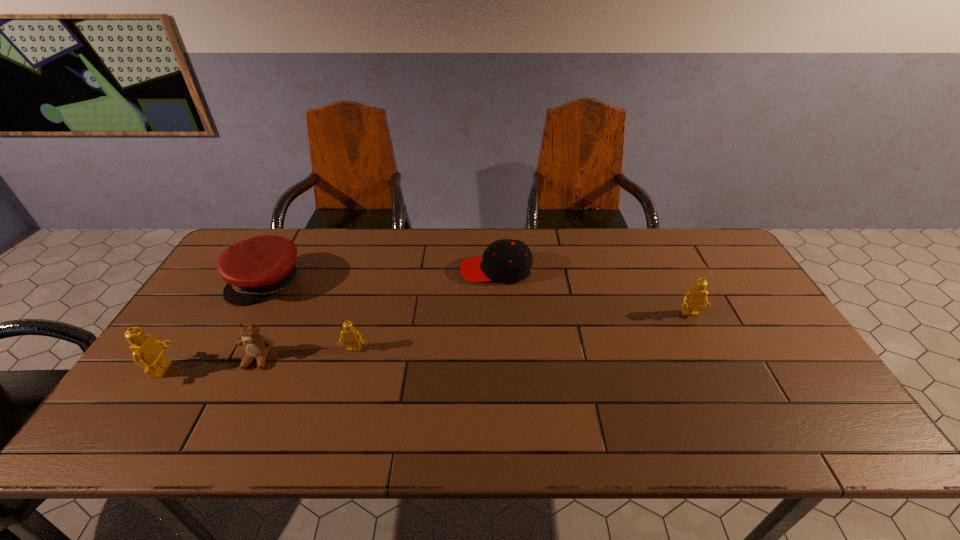
Find the location of a particular element. vacant area that lies between the second object from right to left and the leftmost Lego is located at coordinates (330, 320).

Find the location of `vacant region between the right cap and the leftmost Lego`. vacant region between the right cap and the leftmost Lego is located at coordinates (330, 320).

Where is `free space between the second object from right to left and the shortest Lego`? free space between the second object from right to left and the shortest Lego is located at coordinates (425, 310).

Where is `vacant area between the rightmost Lego and the teddy bear`? This screenshot has height=540, width=960. vacant area between the rightmost Lego and the teddy bear is located at coordinates (474, 336).

Image resolution: width=960 pixels, height=540 pixels. Identify the location of free space that is in between the fourth nearest object and the shortest Lego. (521, 332).

The height and width of the screenshot is (540, 960). Find the location of `vacant area between the left cap and the teddy bear`. vacant area between the left cap and the teddy bear is located at coordinates pyautogui.click(x=262, y=320).

You are a GUI agent. You are given a task and a screenshot of the screen. Output one action in this format:
    pyautogui.click(x=<x>, y=<y>)
    Task: Click on the vacant region between the farthest Lego and the second Lego from left to right
    
    Given the screenshot: What is the action you would take?
    pyautogui.click(x=521, y=332)

Where is `object that is the third closest to the third farthest object`? The width and height of the screenshot is (960, 540). object that is the third closest to the third farthest object is located at coordinates (256, 346).

Identify which object is the fifth closest to the left cap. Please provide its 2D coordinates. Your answer should be formatted as a tuple, i.e. [(x, y)], where the tuple contains the x and y coordinates of a point satisfying the conditions above.

[(693, 300)]

Where is `the second closest Lego relative to the shortest Lego`? the second closest Lego relative to the shortest Lego is located at coordinates (693, 300).